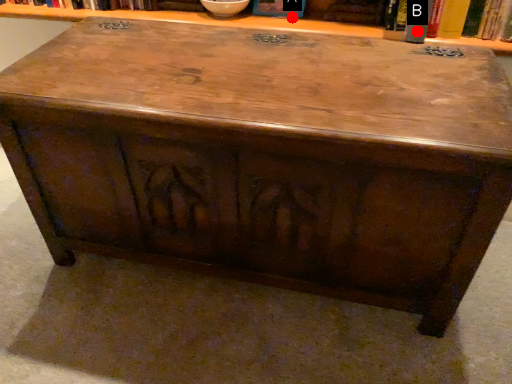
Question: Two points are circled on the image, labeled by A and B beside each circle. Which point is closer to the camera taking this photo?

Choices:
 (A) A is closer
 (B) B is closer

Answer: (B)